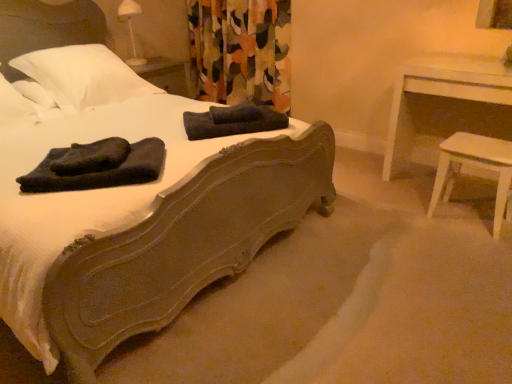
Looking at this image, how much space does dark gray cotton bath towel at center, positioned as the third bath towel in front-to-back order, occupy horizontally?

dark gray cotton bath towel at center, positioned as the third bath towel in front-to-back order, is 14.43 inches wide.

Locate an element on the screen. white wood stool at right is located at coordinates (477, 165).

How much space does black cotton bath towel at left, acting as the 2th bath towel starting from the back, occupy horizontally?

black cotton bath towel at left, acting as the 2th bath towel starting from the back, is 10.72 inches wide.

Locate an element on the screen. The width and height of the screenshot is (512, 384). dark blue fleece bath towel at center, which is the 1th bath towel from front to back is located at coordinates (97, 166).

Is point (501, 85) farther from viewer compared to point (35, 113)?

No.

Can you confirm if white wood table at right is shorter than white soft pillow at upper left, marked as the 1th pillow in a left-to-right arrangement?

No, white wood table at right is not shorter than white soft pillow at upper left, marked as the 1th pillow in a left-to-right arrangement.

Consider the image. From a real-world perspective, which is physically above, white wood table at right or white soft pillow at upper left, marked as the 1th pillow in a left-to-right arrangement?

white soft pillow at upper left, marked as the 1th pillow in a left-to-right arrangement, from a real-world perspective.

Which is in front, white wood table at right or white soft pillow at upper left, marked as the 1th pillow in a left-to-right arrangement?

white wood table at right.

In the image, is floral fabric curtain at center on the left side or the right side of dark blue fleece bath towel at center, which is the 1th bath towel from front to back?

Clearly, floral fabric curtain at center is on the right of dark blue fleece bath towel at center, which is the 1th bath towel from front to back, in the image.

Is floral fabric curtain at center shorter than dark blue fleece bath towel at center, which is the 1th bath towel from front to back?

Incorrect, the height of floral fabric curtain at center does not fall short of that of dark blue fleece bath towel at center, which is the 1th bath towel from front to back.

Is point (272, 12) closer to camera compared to point (91, 177)?

No, it is behind (91, 177).

In the scene shown: Could you measure the distance between floral fabric curtain at center and dark blue fleece bath towel at center, which is the 1th bath towel from front to back?

7.29 feet.

Is white soft pillow at upper left, arranged as the second pillow when viewed from the right, oriented towards white wood stool at right?

No, white soft pillow at upper left, arranged as the second pillow when viewed from the right, does not turn towards white wood stool at right.

Would you consider white soft pillow at upper left, marked as the 1th pillow in a left-to-right arrangement, to be distant from white wood stool at right?

white soft pillow at upper left, marked as the 1th pillow in a left-to-right arrangement, is far away from white wood stool at right.

Is white soft pillow at upper left, marked as the 1th pillow in a left-to-right arrangement, outside of white wood stool at right?

Yes.

Which is behind, point (1, 114) or point (490, 139)?

Point (490, 139)

How distant is white soft pillow at upper left, arranged as the second pillow when viewed from the right, from white wood table at right?

They are 2.35 meters apart.

What's the angular difference between white soft pillow at upper left, marked as the 1th pillow in a left-to-right arrangement, and white wood table at right's facing directions?

→ white soft pillow at upper left, marked as the 1th pillow in a left-to-right arrangement, and white wood table at right are facing 90.3 degrees away from each other.

Between white soft pillow at upper left, arranged as the second pillow when viewed from the right, and white wood table at right, which one appears on the right side from the viewer's perspective?

From the viewer's perspective, white wood table at right appears more on the right side.

Is white soft pillow at upper left, arranged as the second pillow when viewed from the right, looking in the opposite direction of white wood table at right?

white soft pillow at upper left, arranged as the second pillow when viewed from the right, does not have its back to white wood table at right.

Considering the sizes of objects white soft pillow at upper left, the first pillow positioned from the right, and dark gray cotton bath towel at center, the 1th bath towel from the back, in the image provided, who is thinner, white soft pillow at upper left, the first pillow positioned from the right, or dark gray cotton bath towel at center, the 1th bath towel from the back,?

dark gray cotton bath towel at center, the 1th bath towel from the back.

Can you tell me how much white soft pillow at upper left, the first pillow positioned from the right, and dark gray cotton bath towel at center, the 1th bath towel from the back, differ in facing direction?

The facing directions of white soft pillow at upper left, the first pillow positioned from the right, and dark gray cotton bath towel at center, the 1th bath towel from the back, are 38.6 degrees apart.

Is the surface of white soft pillow at upper left, which ranks as the second pillow in left-to-right order, in direct contact with dark gray cotton bath towel at center, positioned as the third bath towel in front-to-back order?

No.

Is white soft pillow at upper left, which ranks as the second pillow in left-to-right order, aimed at dark gray cotton bath towel at center, the 1th bath towel from the back?

Yes, white soft pillow at upper left, which ranks as the second pillow in left-to-right order, is oriented towards dark gray cotton bath towel at center, the 1th bath towel from the back.

Considering the sizes of objects dark gray cotton bath towel at center, positioned as the third bath towel in front-to-back order, and black cotton bath towel at left, which is the 2th bath towel in front-to-back order, in the image provided, who is bigger, dark gray cotton bath towel at center, positioned as the third bath towel in front-to-back order, or black cotton bath towel at left, which is the 2th bath towel in front-to-back order,?

Bigger between the two is dark gray cotton bath towel at center, positioned as the third bath towel in front-to-back order.

Is dark gray cotton bath towel at center, the 1th bath towel from the back, behind black cotton bath towel at left, acting as the 2th bath towel starting from the back?

Yes, dark gray cotton bath towel at center, the 1th bath towel from the back, is further from the viewer.

From a real-world perspective, is dark gray cotton bath towel at center, positioned as the third bath towel in front-to-back order, below black cotton bath towel at left, acting as the 2th bath towel starting from the back?

Yes, from a real-world perspective, dark gray cotton bath towel at center, positioned as the third bath towel in front-to-back order, is below black cotton bath towel at left, acting as the 2th bath towel starting from the back.

From the image's perspective, is white soft pillow at upper left, the first pillow positioned from the right, located above floral fabric curtain at center?

Actually, white soft pillow at upper left, the first pillow positioned from the right, appears below floral fabric curtain at center in the image.

Considering the sizes of white soft pillow at upper left, which ranks as the second pillow in left-to-right order, and floral fabric curtain at center in the image, is white soft pillow at upper left, which ranks as the second pillow in left-to-right order, taller or shorter than floral fabric curtain at center?

Considering their sizes, white soft pillow at upper left, which ranks as the second pillow in left-to-right order, has less height than floral fabric curtain at center.

Could you tell me if white soft pillow at upper left, the first pillow positioned from the right, is facing floral fabric curtain at center?

No, white soft pillow at upper left, the first pillow positioned from the right, is not facing towards floral fabric curtain at center.

Which of these two, white soft pillow at upper left, which ranks as the second pillow in left-to-right order, or floral fabric curtain at center, is bigger?

floral fabric curtain at center is bigger.

In the image, there is a white soft pillow at upper left, arranged as the second pillow when viewed from the right. At what (x,y) coordinates should I click in order to perform the action: click on nightstand below it (from the image's perspective). Please return your answer as a coordinate pair (x, y). This screenshot has height=384, width=512. Looking at the image, I should click on point(440,95).

What are the coordinates of `curtain above the dark blue fleece bath towel at center, the 3th bath towel viewed from the back (from the image's perspective)` in the screenshot? It's located at (241, 50).

From the image, which object appears to be nearer to black cotton bath towel at left, acting as the 2th bath towel starting from the back, white soft pillow at upper left, which ranks as the second pillow in left-to-right order, or white wood stool at right?

The object closer to black cotton bath towel at left, acting as the 2th bath towel starting from the back, is white soft pillow at upper left, which ranks as the second pillow in left-to-right order.

Which object lies nearer to the anchor point dark gray cotton bath towel at center, positioned as the third bath towel in front-to-back order, white wood stool at right or dark blue fleece bath towel at center, the 3th bath towel viewed from the back?

The object closer to dark gray cotton bath towel at center, positioned as the third bath towel in front-to-back order, is dark blue fleece bath towel at center, the 3th bath towel viewed from the back.

Based on their spatial positions, is black cotton bath towel at left, acting as the 2th bath towel starting from the back, or dark gray cotton bath towel at center, the 1th bath towel from the back, further from white soft pillow at upper left, the first pillow positioned from the right?

black cotton bath towel at left, acting as the 2th bath towel starting from the back, is positioned further to the anchor white soft pillow at upper left, the first pillow positioned from the right.

Looking at the image, which one is located closer to dark blue fleece bath towel at center, the 3th bath towel viewed from the back, dark gray cotton bath towel at center, positioned as the third bath towel in front-to-back order, or floral fabric curtain at center?

dark gray cotton bath towel at center, positioned as the third bath towel in front-to-back order.

When comparing their distances from white wood table at right, does white soft pillow at upper left, the first pillow positioned from the right, or dark blue fleece bath towel at center, which is the 1th bath towel from front to back, seem further?

Among the two, white soft pillow at upper left, the first pillow positioned from the right, is located further to white wood table at right.

Looking at the image, which one is located further to black cotton bath towel at left, which is the 2th bath towel in front-to-back order, dark gray cotton bath towel at center, positioned as the third bath towel in front-to-back order, or dark blue fleece bath towel at center, which is the 1th bath towel from front to back?

The object further to black cotton bath towel at left, which is the 2th bath towel in front-to-back order, is dark gray cotton bath towel at center, positioned as the third bath towel in front-to-back order.

Which object lies further to the anchor point white soft pillow at upper left, the first pillow positioned from the right, white soft pillow at upper left, marked as the 1th pillow in a left-to-right arrangement, or white wood stool at right?

The object further to white soft pillow at upper left, the first pillow positioned from the right, is white wood stool at right.

Consider the image. Which object lies nearer to the anchor point dark gray cotton bath towel at center, positioned as the third bath towel in front-to-back order, white wood stool at right or white wood table at right?

white wood stool at right is closer to dark gray cotton bath towel at center, positioned as the third bath towel in front-to-back order.

The height and width of the screenshot is (384, 512). In order to click on stool between matte brown bed at center and white wood table at right from left to right in this screenshot , I will do `click(477, 165)`.

Find the location of `bed between white soft pillow at upper left, the first pillow positioned from the right, and white wood table at right`. bed between white soft pillow at upper left, the first pillow positioned from the right, and white wood table at right is located at coordinates (182, 242).

The width and height of the screenshot is (512, 384). I want to click on stool between black cotton bath towel at left, which is the 2th bath towel in front-to-back order, and white wood table at right from left to right, so click(477, 165).

At what (x,y) coordinates should I click in order to perform the action: click on curtain between white soft pillow at upper left, which ranks as the second pillow in left-to-right order, and white wood stool at right, in the horizontal direction. Please return your answer as a coordinate pair (x, y). Image resolution: width=512 pixels, height=384 pixels. Looking at the image, I should click on (241, 50).